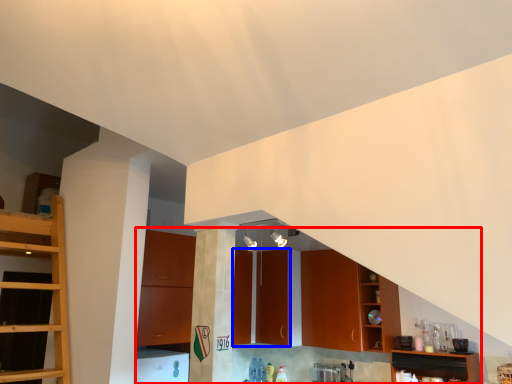
Question: Which point is closer to the camera, cabinetry (highlighted by a red box) or cabinetry (highlighted by a blue box)?

Choices:
 (A) cabinetry
 (B) cabinetry

Answer: (A)